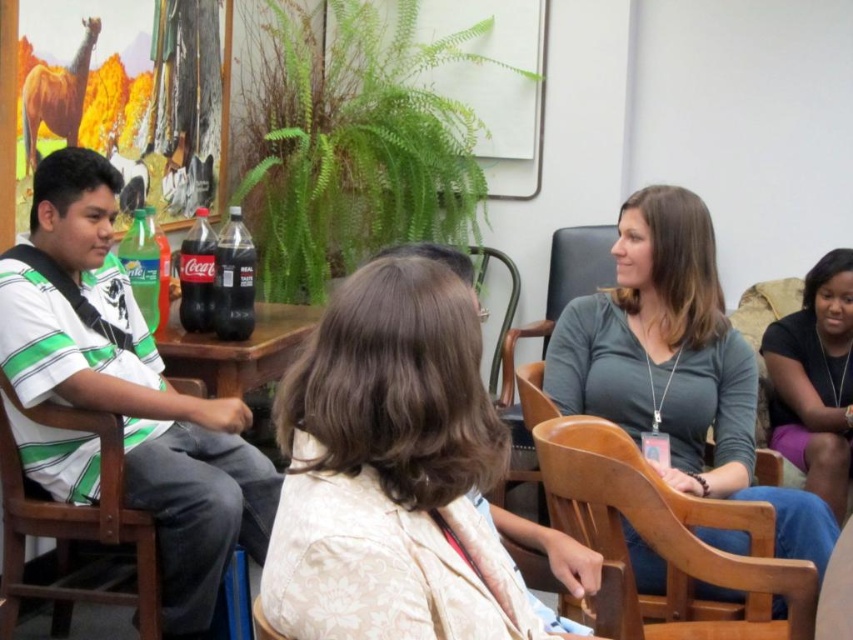
Question: Is smooth beige blouse at center in front of gray matte shirt at center?

Choices:
 (A) yes
 (B) no

Answer: (A)

Question: Is smooth beige blouse at center wider than wooden chair at left?

Choices:
 (A) no
 (B) yes

Answer: (B)

Question: Which point appears closest to the camera in this image?

Choices:
 (A) (280, 324)
 (B) (357, 584)
 (C) (556, 372)

Answer: (B)

Question: Which object appears closest to the camera in this image?

Choices:
 (A) smooth beige blouse at center
 (B) white striped shirt at left
 (C) black matte shirt at right

Answer: (A)

Question: Can you confirm if smooth beige blouse at center is positioned to the right of white striped shirt at left?

Choices:
 (A) no
 (B) yes

Answer: (B)

Question: Which is farther from the black plastic coca-cola bottle at center?

Choices:
 (A) black matte shirt at right
 (B) smooth beige blouse at center

Answer: (A)